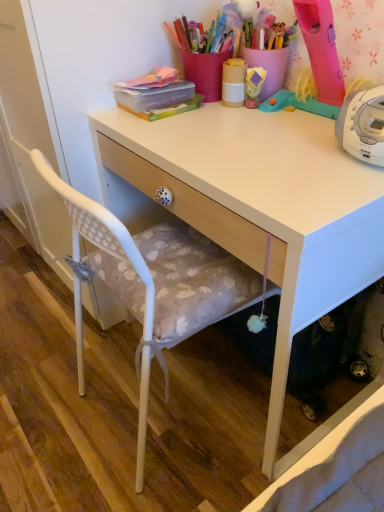
This screenshot has width=384, height=512. Identify the location of free space to the left of white plastic chair at left. (56, 396).